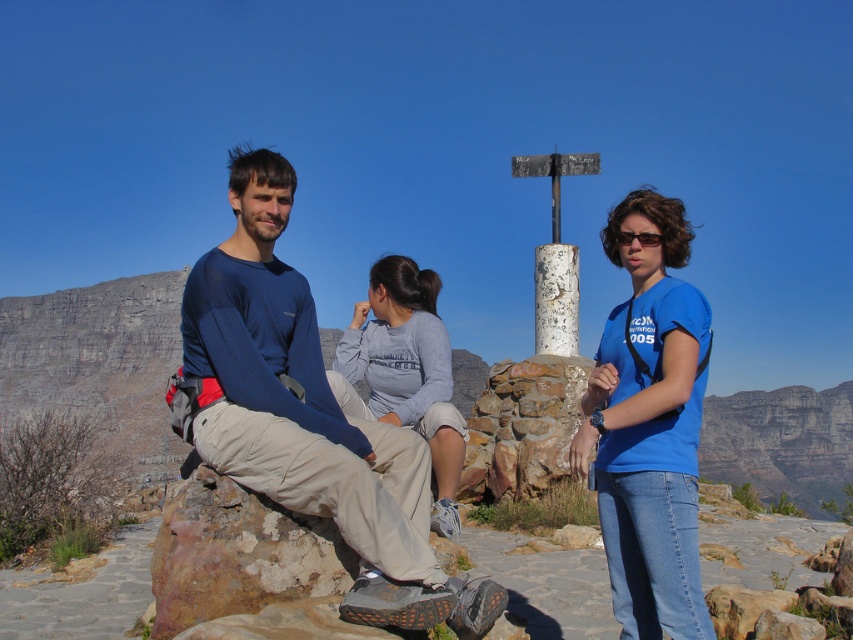
Who is positioned more to the left, blue long-sleeve shirt at center or blue cotton shirt at center?

From the viewer's perspective, blue long-sleeve shirt at center appears more on the left side.

In the scene shown: Can you confirm if blue long-sleeve shirt at center is taller than blue cotton shirt at center?

Incorrect, blue long-sleeve shirt at center's height is not larger of blue cotton shirt at center's.

I want to click on blue long-sleeve shirt at center, so click(306, 417).

At what (x,y) coordinates should I click in order to perform the action: click on blue long-sleeve shirt at center. Please return your answer as a coordinate pair (x, y). The width and height of the screenshot is (853, 640). Looking at the image, I should click on (306, 417).

Is point (643, 636) in front of point (422, 301)?

Yes, point (643, 636) is closer to viewer.

Between point (660, 502) and point (347, 336), which one is positioned in front?

Point (660, 502)

Is point (640, 193) positioned in front of point (372, 282)?

Yes, point (640, 193) is in front of point (372, 282).

Find the location of a particular element. The image size is (853, 640). blue cotton shirt at center is located at coordinates (648, 422).

Which is in front, point (236, 156) or point (416, 321)?

Point (236, 156)

You are a GUI agent. You are given a task and a screenshot of the screen. Output one action in this format:
    pyautogui.click(x=<x>, y=<y>)
    Task: Click on the blue long-sleeve shirt at center
    This screenshot has height=640, width=853.
    Given the screenshot: What is the action you would take?
    pyautogui.click(x=306, y=417)